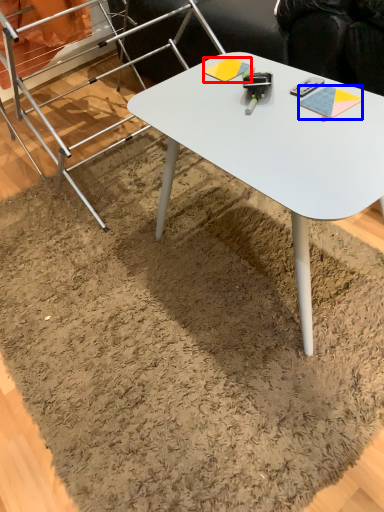
Question: Which object appears closest to the camera in this image, notepad (highlighted by a red box) or notepad (highlighted by a blue box)?

Choices:
 (A) notepad
 (B) notepad

Answer: (B)